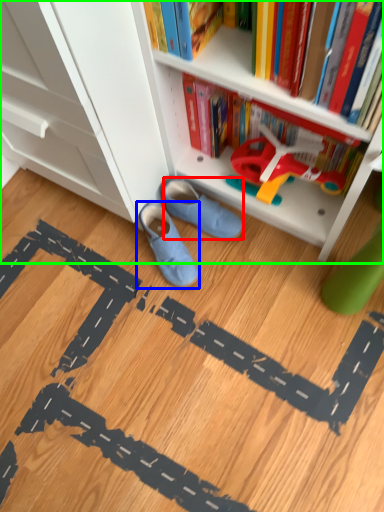
Question: Considering the real-world distances, which object is farthest from footwear (highlighted by a red box)? footwear (highlighted by a blue box) or bookcase (highlighted by a green box)?

Choices:
 (A) footwear
 (B) bookcase

Answer: (B)